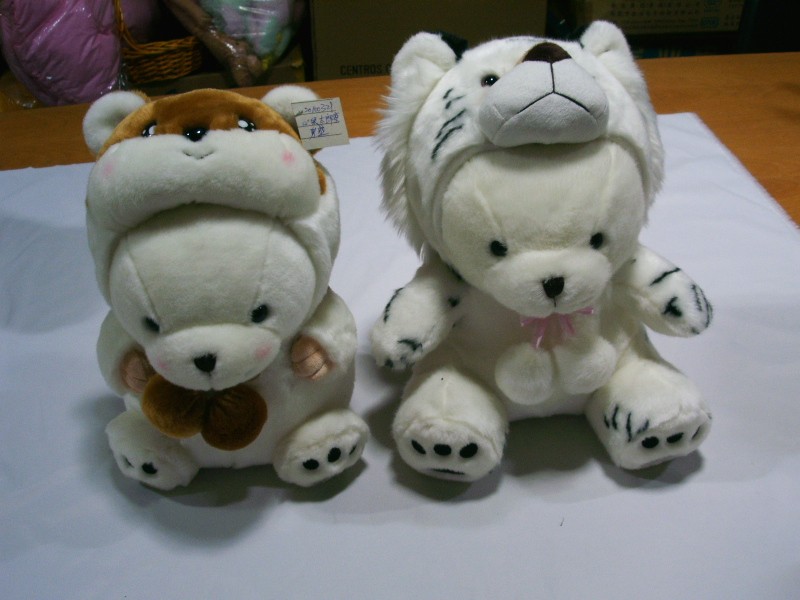
I want to click on wicker basket, so click(x=162, y=53).